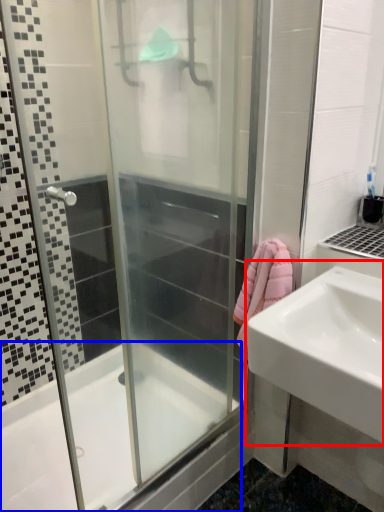
Question: Which point is further to the camera, sink (highlighted by a red box) or bathtub (highlighted by a blue box)?

Choices:
 (A) sink
 (B) bathtub

Answer: (B)